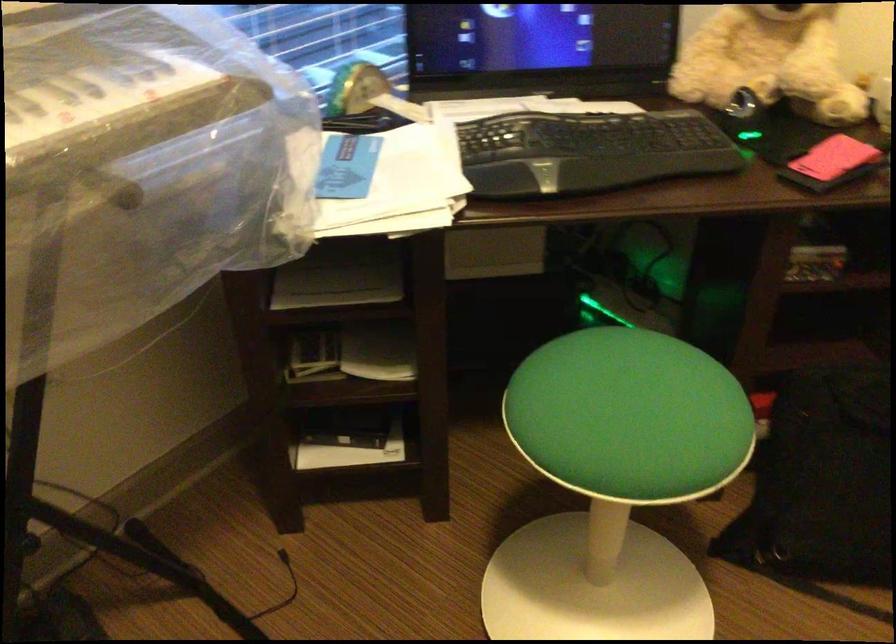
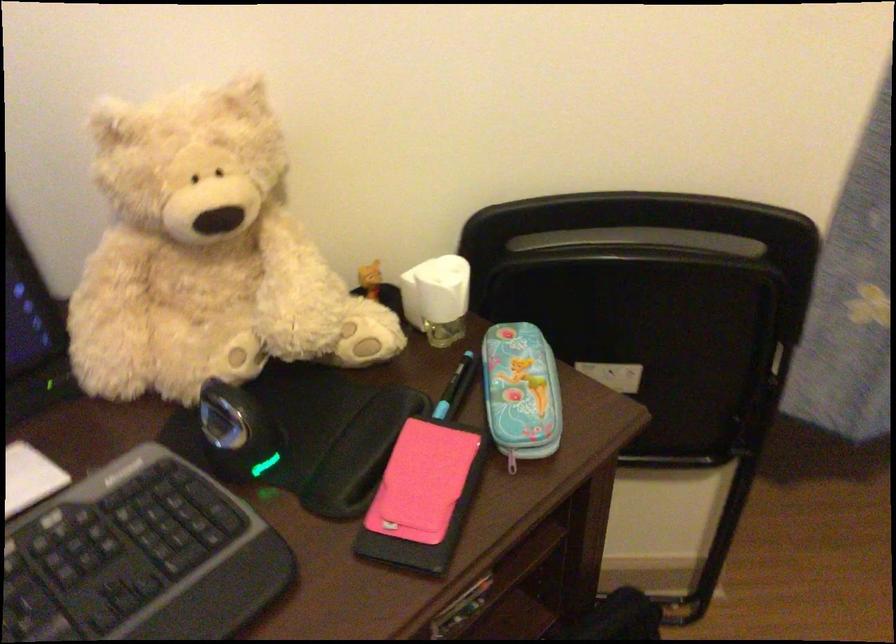
Question: The first image is from the beginning of the video and the second image is from the end. How did the camera likely rotate when shooting the video?

Choices:
 (A) Left
 (B) Right
 (C) Up
 (D) Down

Answer: (B)